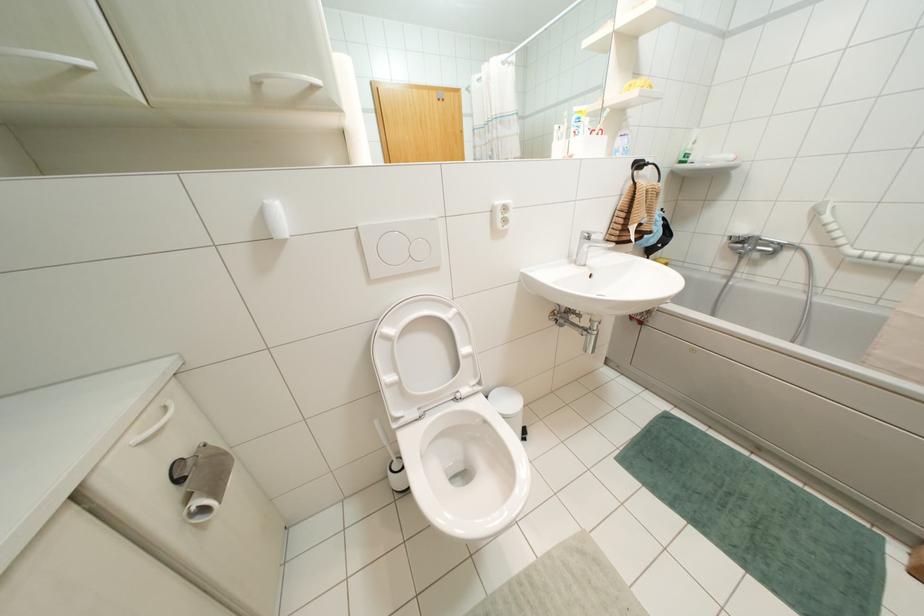
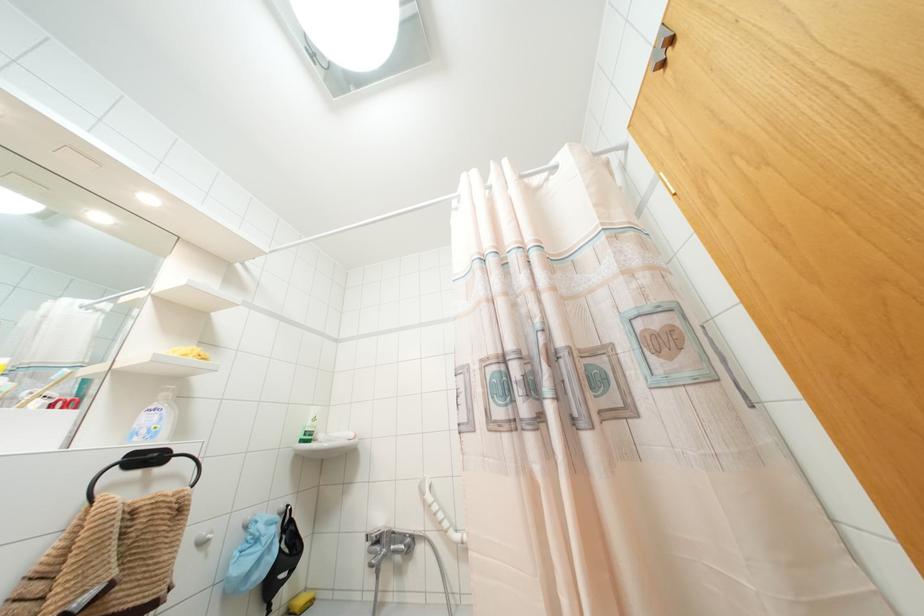
Find the pixel in the second image that matches point (757, 244) in the first image.

(390, 541)